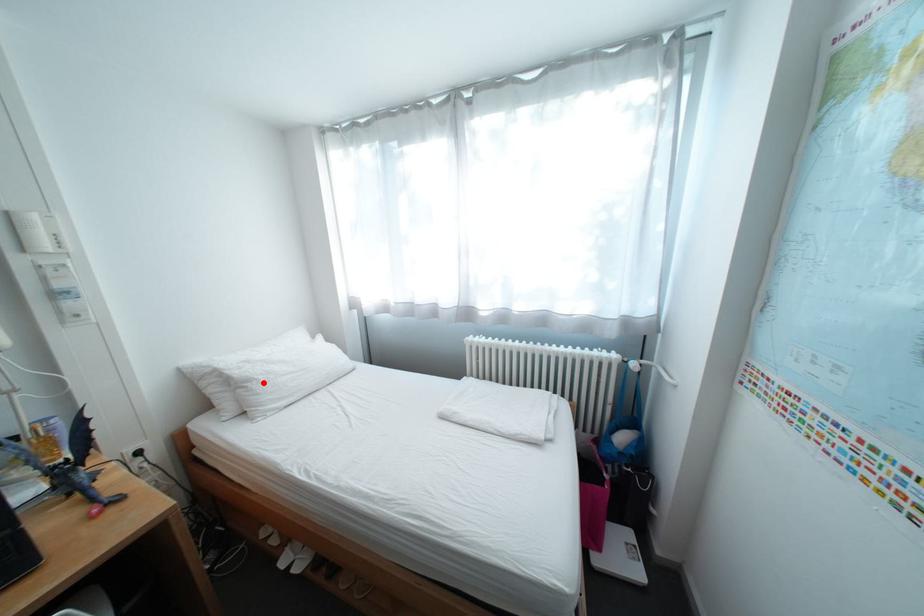
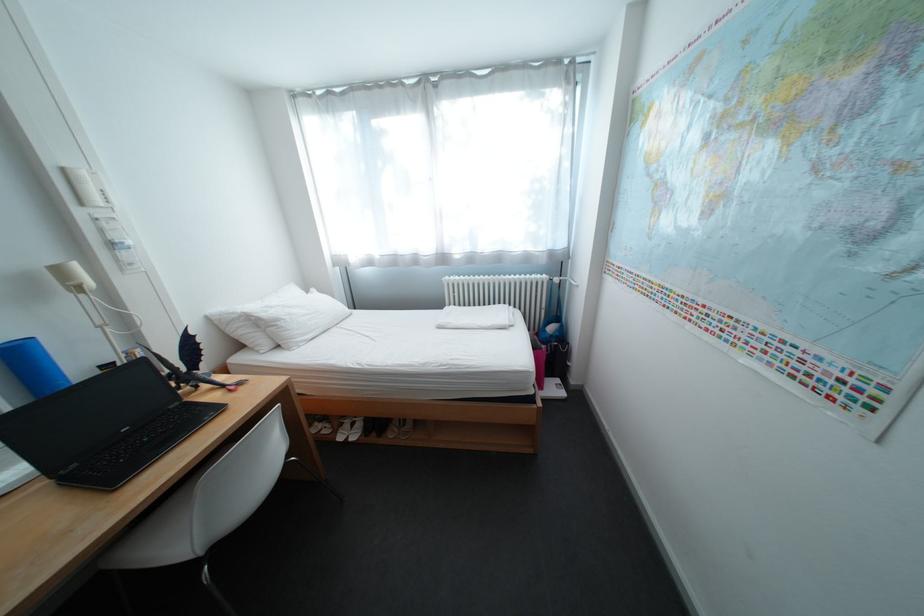
Question: I am providing you with two images of the same scene from different viewpoints. In image1, a red point is highlighted. Considering the same 3D point in image2, which of the following is correct?

Choices:
 (A) It is closer
 (B) It is farther

Answer: (A)